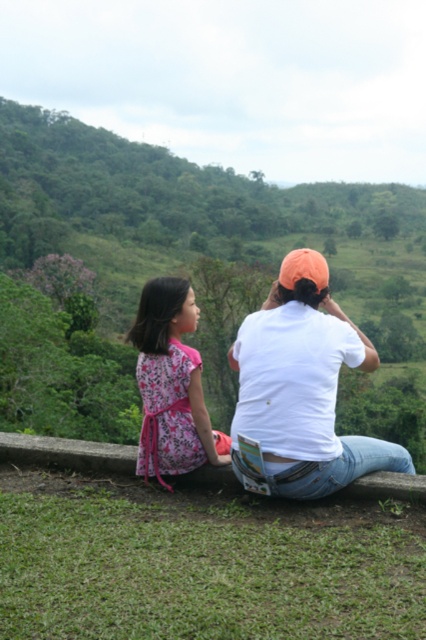
How far apart are white cotton shirt at center and floral fabric dress at left?

1.15 meters

Is white cotton shirt at center behind floral fabric dress at left?

No, it is not.

Who is more forward, [258,336] or [155,371]?

Point [258,336] is more forward.

At what (x,y) coordinates should I click in order to perform the action: click on white cotton shirt at center. Please return your answer as a coordinate pair (x, y). The image size is (426, 640). Looking at the image, I should click on (301, 390).

Is floral fabric dress at left thinner than concrete ledge at center?

In fact, floral fabric dress at left might be wider than concrete ledge at center.

Who is more distant from viewer, (201, 396) or (104, 445)?

The point (104, 445) is more distant.

This screenshot has width=426, height=640. What do you see at coordinates (172, 385) in the screenshot?
I see `floral fabric dress at left` at bounding box center [172, 385].

This screenshot has height=640, width=426. Identify the location of floral fabric dress at left. (172, 385).

Does white cotton shirt at center have a lesser width compared to concrete ledge at center?

No.

Is white cotton shirt at center bigger than concrete ledge at center?

Yes, white cotton shirt at center is bigger than concrete ledge at center.

Does point (334, 416) come in front of point (75, 449)?

Yes, it is.

The image size is (426, 640). Identify the location of white cotton shirt at center. pyautogui.click(x=301, y=390).